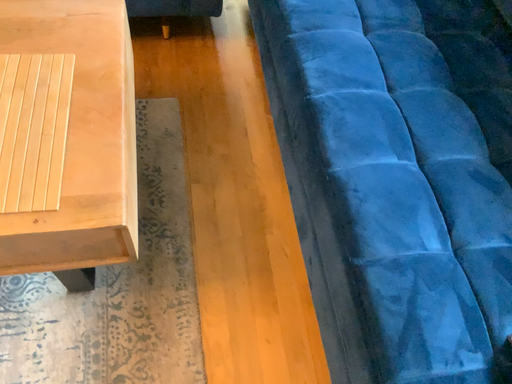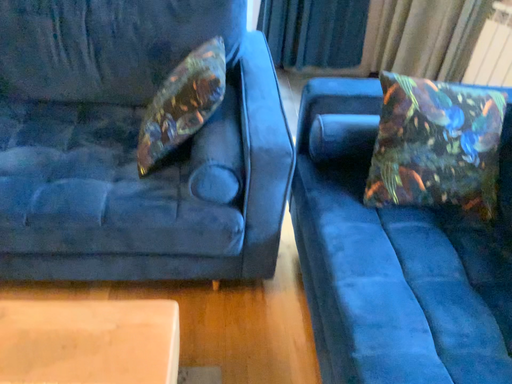
Question: How did the camera likely rotate when shooting the video?

Choices:
 (A) rotated upward
 (B) rotated downward

Answer: (A)